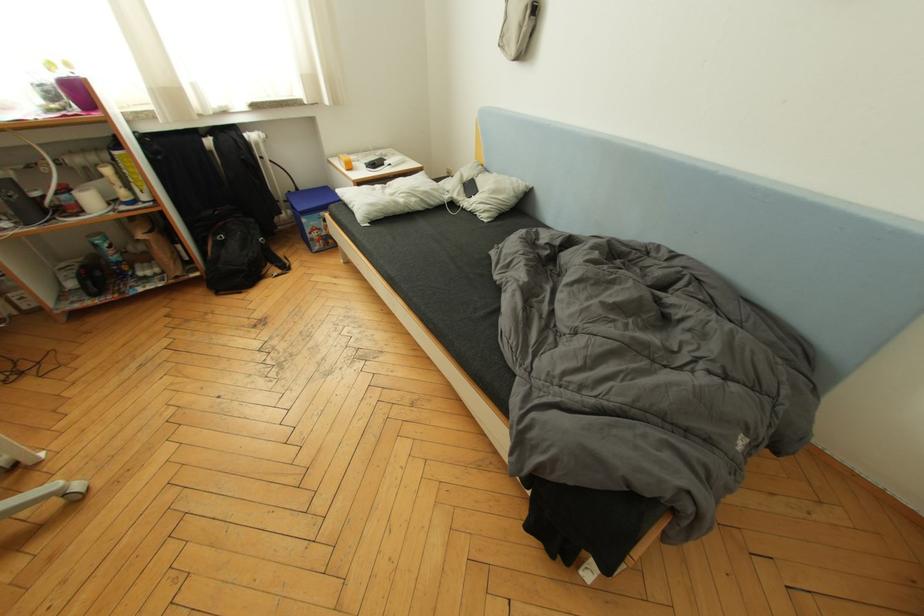
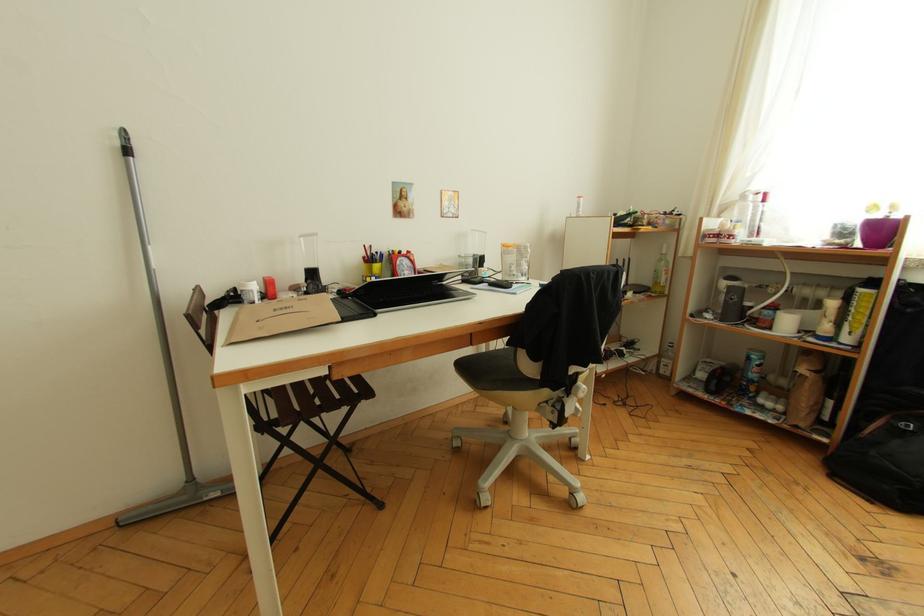
Question: How did the camera likely rotate?

Choices:
 (A) Left
 (B) Right
 (C) Up
 (D) Down

Answer: (A)